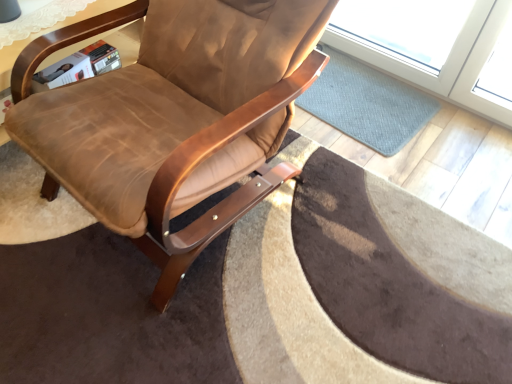
Question: Looking at their shapes, would you say brown leather chair at center is wider or thinner than wooden table at upper left?

Choices:
 (A) thin
 (B) wide

Answer: (B)

Question: Considering the positions of brown leather chair at center and wooden table at upper left in the image, is brown leather chair at center bigger or smaller than wooden table at upper left?

Choices:
 (A) big
 (B) small

Answer: (A)

Question: Which object is positioned closest to the wooden table at upper left?

Choices:
 (A) brown leather chair at center
 (B) blue textured mat at center

Answer: (A)

Question: Based on their relative distances, which object is farther from the wooden table at upper left?

Choices:
 (A) brown leather chair at center
 (B) blue textured mat at center

Answer: (B)